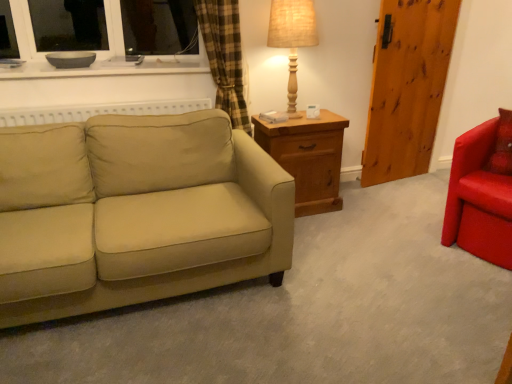
Identify the location of burlap fabric table lamp at upper right. The width and height of the screenshot is (512, 384). (292, 37).

Identify the location of white glossy bowl at upper left. This screenshot has height=384, width=512. (103, 69).

Measure the distance between point (x=40, y=64) and camera.

The depth of point (x=40, y=64) is 2.53 meters.

Measure the distance between shiny red armchair at right and camera.

A distance of 7.06 feet exists between shiny red armchair at right and camera.

Consider the image. Measure the distance between point (323, 199) and camera.

They are 2.84 meters apart.

Where is `wooden barn door at right`? The image size is (512, 384). wooden barn door at right is located at coordinates (407, 87).

Is beige fabric couch at left oriented away from wooden nightstand at center?

No, wooden nightstand at center is not at the back of beige fabric couch at left.

From the image's perspective, would you say beige fabric couch at left is shown under wooden nightstand at center?

Indeed, from the image's perspective, beige fabric couch at left is shown beneath wooden nightstand at center.

This screenshot has width=512, height=384. What are the coordinates of `studio couch above the wooden nightstand at center (from a real-world perspective)` in the screenshot? It's located at (144, 218).

Looking at this image, can wooden nightstand at center be found inside beige fabric couch at left?

No, wooden nightstand at center is not inside beige fabric couch at left.

Can you confirm if wooden nightstand at center is shorter than burlap fabric table lamp at upper right?

Correct, wooden nightstand at center is not as tall as burlap fabric table lamp at upper right.

Is wooden nightstand at center further to the viewer compared to burlap fabric table lamp at upper right?

That is True.

From the image's perspective, which one is positioned higher, wooden nightstand at center or burlap fabric table lamp at upper right?

burlap fabric table lamp at upper right, from the image's perspective.

Identify the location of nightstand located underneath the burlap fabric table lamp at upper right (from a real-world perspective). (308, 157).

From a real-world perspective, relative to shiny red armchair at right, is white glossy bowl at upper left vertically above or below?

From a real-world perspective, white glossy bowl at upper left is physically above shiny red armchair at right.

Is white glossy bowl at upper left further to the viewer compared to shiny red armchair at right?

Yes.

Are white glossy bowl at upper left and shiny red armchair at right far apart?

Absolutely, white glossy bowl at upper left is distant from shiny red armchair at right.

Considering the positions of point (30, 71) and point (490, 160), is point (30, 71) closer or farther from the camera than point (490, 160)?

Clearly, point (30, 71) is more distant from the camera than point (490, 160).

Is shiny red armchair at right smaller than wooden barn door at right?

Incorrect, shiny red armchair at right is not smaller in size than wooden barn door at right.

Does shiny red armchair at right come behind wooden barn door at right?

No, the depth of shiny red armchair at right is less than that of wooden barn door at right.

The image size is (512, 384). There is a shiny red armchair at right. What are the coordinates of `barn door above it (from a real-world perspective)` in the screenshot? It's located at (407, 87).

Is shiny red armchair at right spatially inside wooden barn door at right, or outside of it?

shiny red armchair at right is located beyond the bounds of wooden barn door at right.

Are burlap fabric table lamp at upper right and white glossy bowl at upper left far apart?

No, burlap fabric table lamp at upper right is not far away from white glossy bowl at upper left.

Considering the positions of point (290, 63) and point (101, 69), is point (290, 63) closer or farther from the camera than point (101, 69)?

Clearly, point (290, 63) is more distant from the camera than point (101, 69).

You are a GUI agent. You are given a task and a screenshot of the screen. Output one action in this format:
    pyautogui.click(x=<x>, y=<y>)
    Task: Click on the window sill that appears below the burlap fabric table lamp at upper right (from the image's perspective)
    The width and height of the screenshot is (512, 384).
    Given the screenshot: What is the action you would take?
    103,69

From a real-world perspective, is burlap fabric table lamp at upper right below white glossy bowl at upper left?

No, from a real-world perspective, burlap fabric table lamp at upper right is not below white glossy bowl at upper left.

Between burlap fabric table lamp at upper right and shiny red armchair at right, which one appears on the right side from the viewer's perspective?

shiny red armchair at right is more to the right.

Is burlap fabric table lamp at upper right bigger than shiny red armchair at right?

No.

Based on the photo, how many degrees apart are the facing directions of burlap fabric table lamp at upper right and shiny red armchair at right?

There is a 69.5-degree angle between the facing directions of burlap fabric table lamp at upper right and shiny red armchair at right.

Is burlap fabric table lamp at upper right behind shiny red armchair at right?

Yes, burlap fabric table lamp at upper right is further from the viewer.

Looking at this image, is shiny red armchair at right located outside burlap fabric table lamp at upper right?

shiny red armchair at right lies outside burlap fabric table lamp at upper right's area.

Is shiny red armchair at right aimed at burlap fabric table lamp at upper right?

No, shiny red armchair at right is not turned towards burlap fabric table lamp at upper right.

From the image's perspective, is shiny red armchair at right above or below burlap fabric table lamp at upper right?

shiny red armchair at right is below burlap fabric table lamp at upper right.

Considering their positions, is shiny red armchair at right located in front of or behind burlap fabric table lamp at upper right?

shiny red armchair at right is positioned closer to the viewer than burlap fabric table lamp at upper right.

Find the location of a particular element. studio couch that appears above the wooden nightstand at center (from a real-world perspective) is located at coordinates (144, 218).

This screenshot has height=384, width=512. I want to click on nightstand located below the burlap fabric table lamp at upper right (from the image's perspective), so click(x=308, y=157).

Which object lies further to the anchor point burlap fabric table lamp at upper right, beige fabric couch at left or wooden barn door at right?

beige fabric couch at left is further to burlap fabric table lamp at upper right.

Estimate the real-world distances between objects in this image. Which object is closer to beige fabric couch at left, shiny red armchair at right or white glossy bowl at upper left?

Among the two, white glossy bowl at upper left is located nearer to beige fabric couch at left.

Based on their spatial positions, is wooden nightstand at center or burlap fabric table lamp at upper right closer to wooden barn door at right?

Among the two, wooden nightstand at center is located nearer to wooden barn door at right.

Based on their spatial positions, is wooden barn door at right or wooden nightstand at center further from beige fabric couch at left?

Among the two, wooden barn door at right is located further to beige fabric couch at left.

Estimate the real-world distances between objects in this image. Which object is further from beige fabric couch at left, wooden nightstand at center or shiny red armchair at right?

shiny red armchair at right.

Estimate the real-world distances between objects in this image. Which object is closer to burlap fabric table lamp at upper right, white glossy bowl at upper left or beige fabric couch at left?

white glossy bowl at upper left is closer to burlap fabric table lamp at upper right.

Estimate the real-world distances between objects in this image. Which object is further from wooden barn door at right, wooden nightstand at center or beige fabric couch at left?

beige fabric couch at left is further to wooden barn door at right.

Consider the image. From the image, which object appears to be farther from burlap fabric table lamp at upper right, white glossy bowl at upper left or wooden barn door at right?

Among the two, wooden barn door at right is located further to burlap fabric table lamp at upper right.

Identify the location of nightstand between beige fabric couch at left and wooden barn door at right from left to right. Image resolution: width=512 pixels, height=384 pixels. (308, 157).

Find the location of `barn door situated between beige fabric couch at left and shiny red armchair at right from left to right`. barn door situated between beige fabric couch at left and shiny red armchair at right from left to right is located at coordinates (407, 87).

The width and height of the screenshot is (512, 384). I want to click on table lamp between beige fabric couch at left and wooden nightstand at center from front to back, so click(292, 37).

Where is `studio couch between white glossy bowl at upper left and burlap fabric table lamp at upper right from left to right`? The width and height of the screenshot is (512, 384). studio couch between white glossy bowl at upper left and burlap fabric table lamp at upper right from left to right is located at coordinates (144, 218).